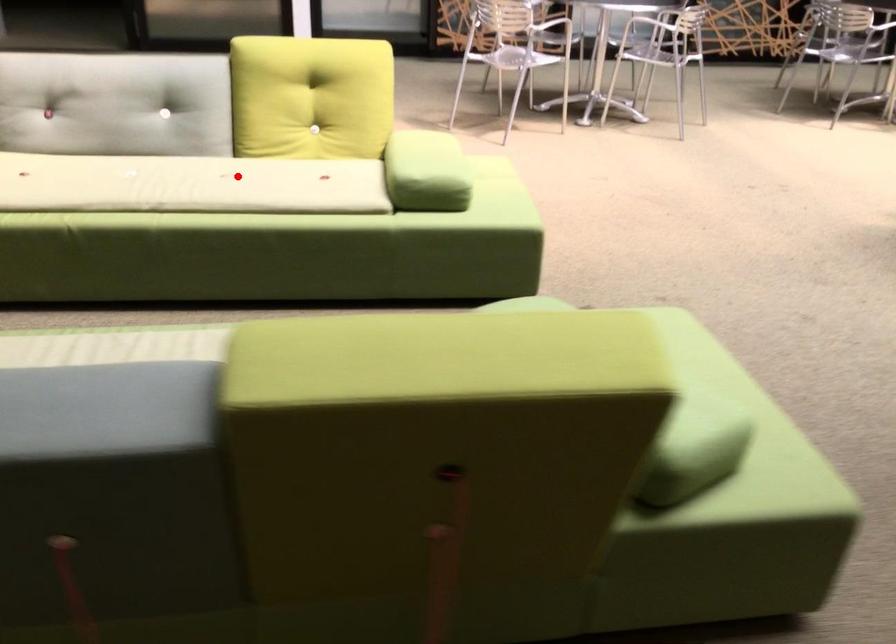
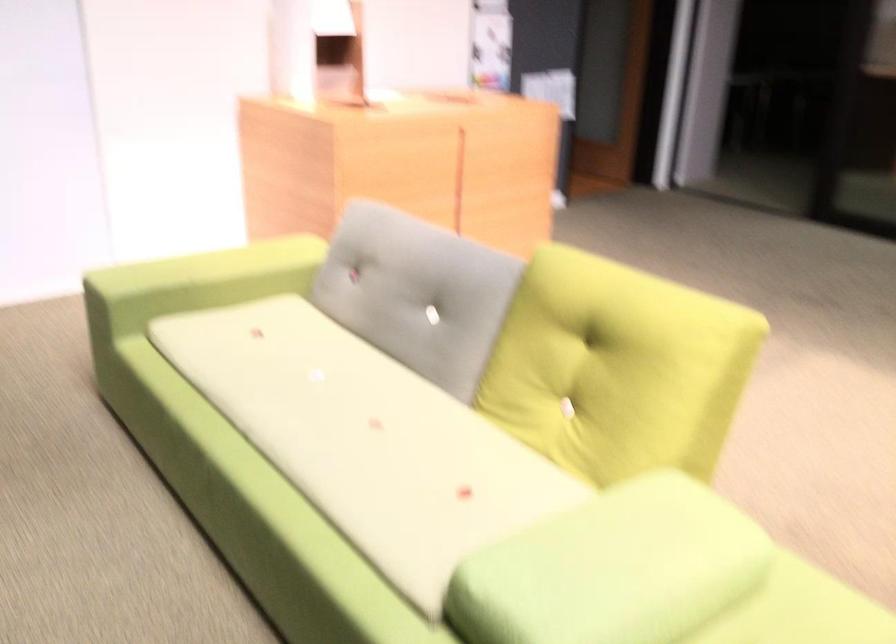
Locate, in the second image, the point that corresponds to the highlighted location in the first image.

(366, 439)